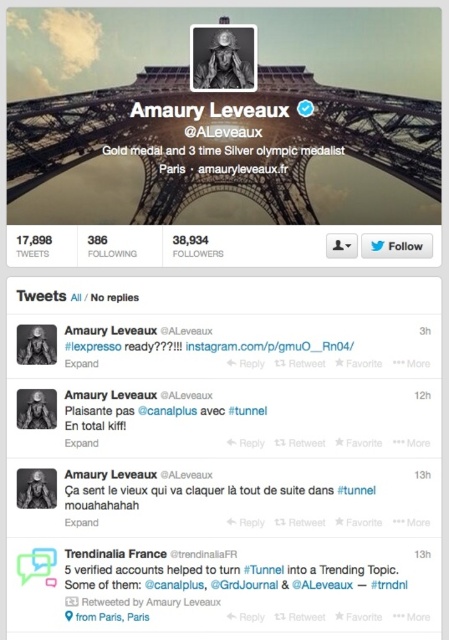
You are designing a virtual tour of this Twitter profile. To ensure accessibility, you need to place a text box that accommodates both the metallic structure at upper center and the black matte portrait at upper center. What is the minimum distance the text box must span to cover both objects?

The metallic structure at upper center and black matte portrait at upper center are 57.29 feet apart, so the text box must span at least 57.29 feet to cover both objects.

You are designing a digital poster and need to place two elements from the Twitter profile of Amaury Leveaux. The metallic structure at upper center and the black matte portrait at upper center are both candidates. If you want to ensure that the wider element occupies more horizontal space, which one should you choose?

The metallic structure at upper center is wider than the black matte portrait at upper center, so you should choose the metallic structure at upper center to occupy more horizontal space.

You are analyzing the Twitter profile of Amaury Leveaux. There are two points marked on the profile image at coordinates point (251, 195) and point (246, 54). Which point is closer to the camera?

Point (251, 195) is further to the camera than point (246, 54), so the point closer to the camera is point (246, 54).